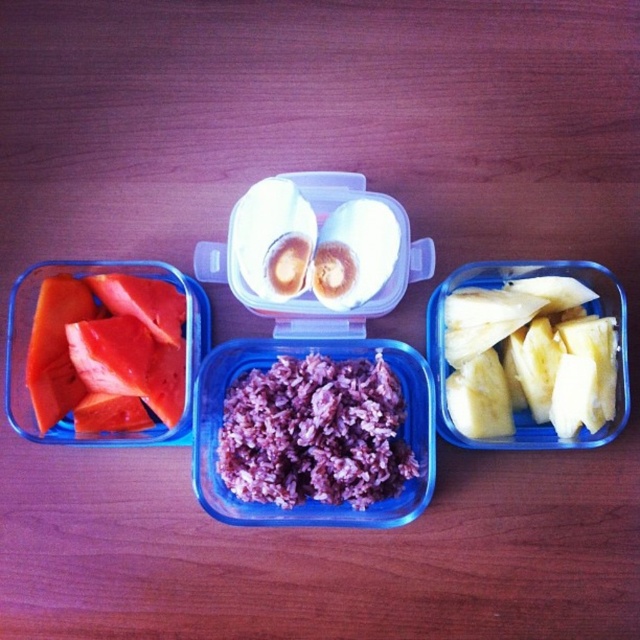
Question: Can you confirm if purple matte rice at center is smaller than smooth red tomato slices at left?

Choices:
 (A) yes
 (B) no

Answer: (B)

Question: Does translucent plastic container at left have a lesser width compared to purple matte rice at center?

Choices:
 (A) yes
 (B) no

Answer: (B)

Question: Among these objects, which one is farthest from the camera?

Choices:
 (A) translucent plastic container at left
 (B) purple matte rice at center
 (C) smooth red tomato slices at left

Answer: (B)

Question: Which point is farther to the camera?

Choices:
 (A) (353, 452)
 (B) (500, 324)

Answer: (B)

Question: Based on their relative distances, which object is nearer to the yellow smooth pineapple at right?

Choices:
 (A) smooth red tomato slices at left
 (B) purple matte rice at center

Answer: (B)

Question: Is purple matte rice at center below yellow smooth pineapple at right?

Choices:
 (A) no
 (B) yes

Answer: (B)